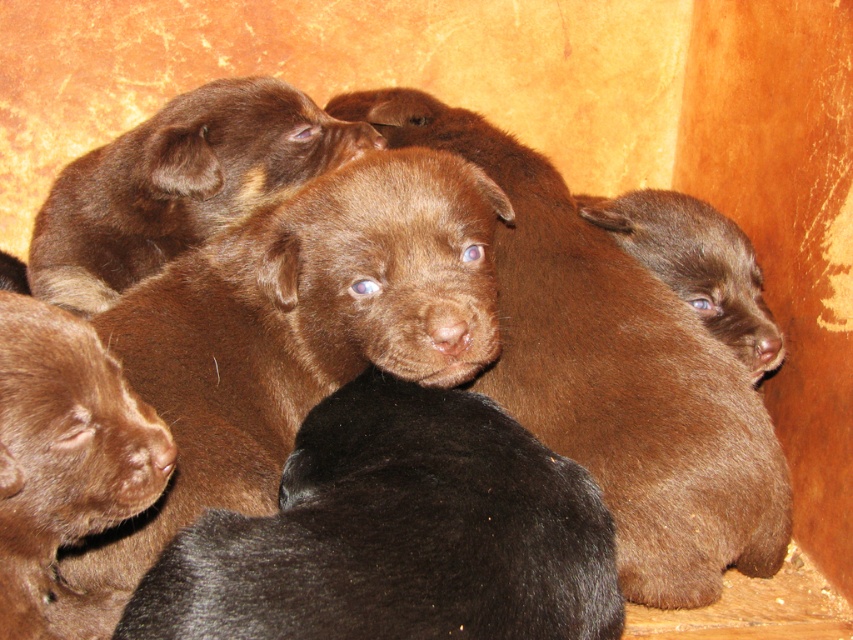
Between point (250, 173) and point (625, 237), which one is positioned behind?

Positioned behind is point (625, 237).

Which of these two, brown furry puppy at center or brown fur puppy at center, stands shorter?

Standing shorter between the two is brown fur puppy at center.

Does point (165, 202) come closer to viewer compared to point (601, 204)?

Yes, it is in front of point (601, 204).

Locate an element on the screen. This screenshot has width=853, height=640. brown furry puppy at center is located at coordinates (178, 184).